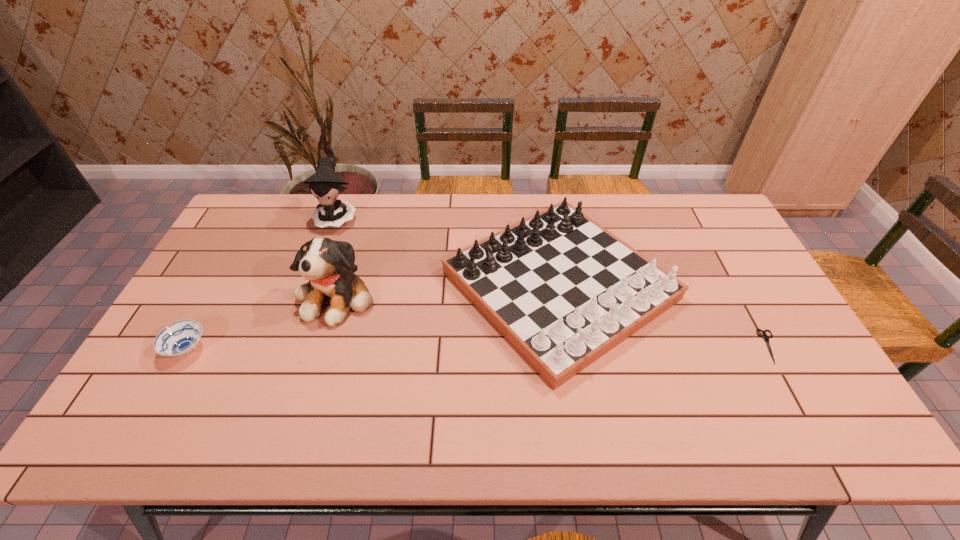
Where is `free area in between the gameboard and the soup bowl`? free area in between the gameboard and the soup bowl is located at coordinates (373, 317).

The image size is (960, 540). In order to click on free space between the doll and the second shortest object in this screenshot , I will do `click(262, 282)`.

The width and height of the screenshot is (960, 540). Find the location of `object that is the third closest to the fourth tallest object`. object that is the third closest to the fourth tallest object is located at coordinates (563, 291).

Where is `object that is the fourth closest to the doll`? The image size is (960, 540). object that is the fourth closest to the doll is located at coordinates (766, 338).

Find the location of a particular element. vacant space that satisfies the following two spatial constraints: 1. at the face of the third tallest object; 2. on the left side of the doll is located at coordinates (313, 286).

Locate an element on the screen. The width and height of the screenshot is (960, 540). free space that satisfies the following two spatial constraints: 1. at the face of the puppy; 2. on the right side of the rightmost object is located at coordinates (323, 347).